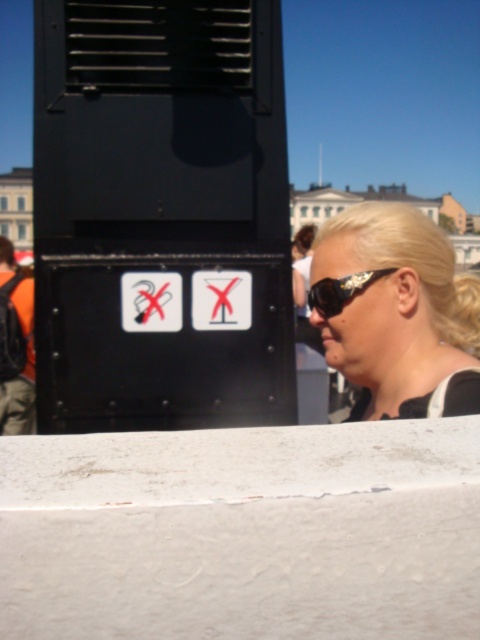
You are standing at the camera position and want to reach the point marked at coordinates (332, 308). If your walking speed is 3 feet per second, how many seconds will it take you to reach that point?

The distance to the point is 8.65 feet, so at 3 feet per second, it would take approximately 2.88 seconds to reach the point.